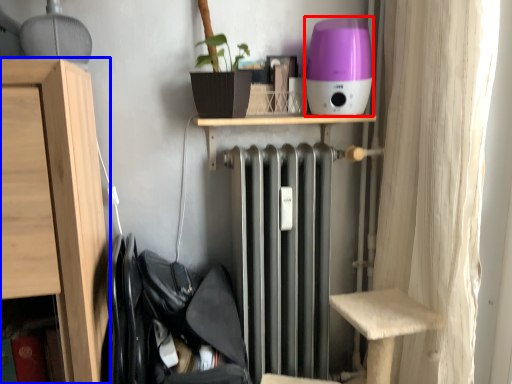
Question: Which of the following is the farthest to the observer, appliance (highlighted by a red box) or furniture (highlighted by a blue box)?

Choices:
 (A) appliance
 (B) furniture

Answer: (A)